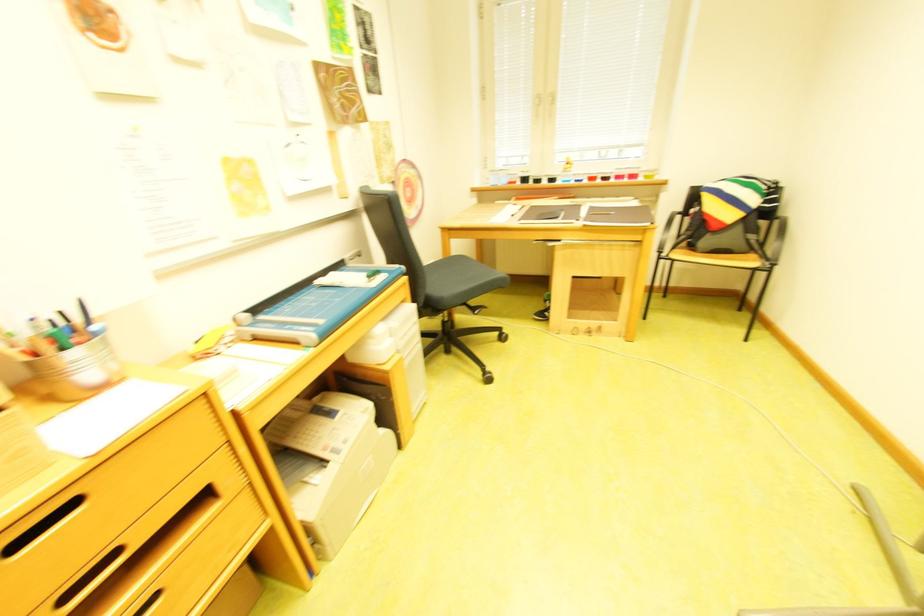
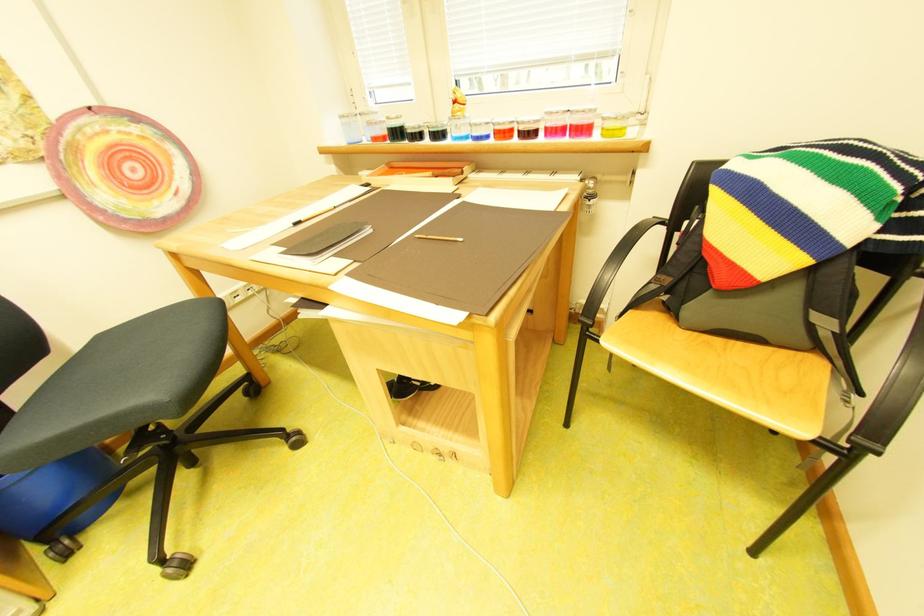
Find the pixel in the second image that matches (536,180) in the first image.

(407, 135)